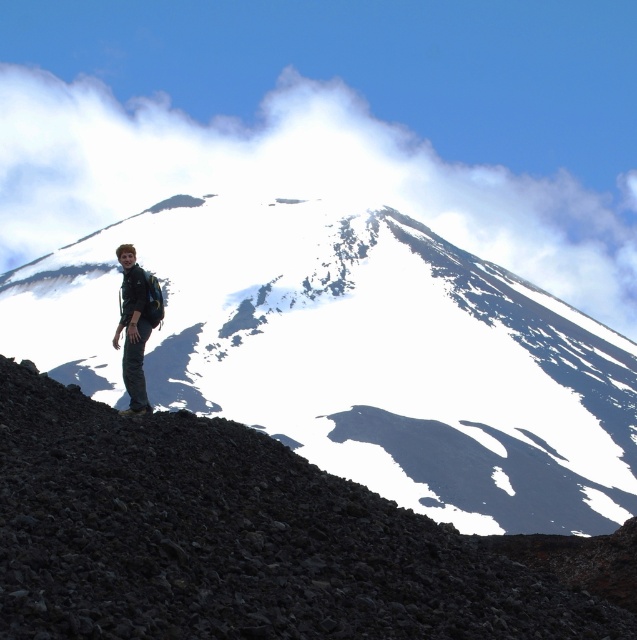
Question: Is dark gray gravel at lower left to the right of matte black jacket at lower left from the viewer's perspective?

Choices:
 (A) no
 (B) yes

Answer: (B)

Question: Which point appears closest to the camera in this image?

Choices:
 (A) (527, 225)
 (B) (562, 612)

Answer: (B)

Question: Can you confirm if dark gray gravel at lower left is smaller than matte black jacket at lower left?

Choices:
 (A) no
 (B) yes

Answer: (A)

Question: Can you confirm if snowy rocky mountain at center is wider than matte black jacket at lower left?

Choices:
 (A) yes
 (B) no

Answer: (A)

Question: Which of these objects is positioned farthest from the white fluffy cloud at upper center?

Choices:
 (A) dark gray gravel at lower left
 (B) matte black jacket at lower left
 (C) snowy rocky mountain at center

Answer: (B)

Question: Which object is the closest to the dark gray gravel at lower left?

Choices:
 (A) white fluffy cloud at upper center
 (B) snowy rocky mountain at center

Answer: (B)